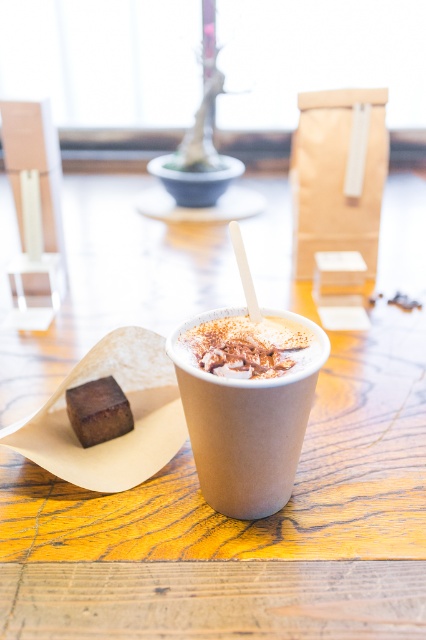
Is brown paper cup at center taller than creme matte coffee cup at center?

Yes, brown paper cup at center is taller than creme matte coffee cup at center.

Which is more to the left, brown paper cup at center or creme matte coffee cup at center?

Positioned to the left is brown paper cup at center.

Is point (180, 388) closer to camera compared to point (219, 326)?

Yes.

Locate an element on the screen. The height and width of the screenshot is (640, 426). brown paper cup at center is located at coordinates (247, 422).

Who is more forward, (239,504) or (86,424)?

Positioned in front is point (239,504).

Between point (261, 472) and point (106, 419), which one is positioned behind?

The point (106, 419) is more distant.

Locate an element on the screen. brown paper cup at center is located at coordinates (247, 422).

Does wooden table at center have a greater height compared to creme matte coffee cup at center?

Yes.

Based on the photo, is wooden table at center positioned behind creme matte coffee cup at center?

No, it is in front of creme matte coffee cup at center.

Locate an element on the screen. The width and height of the screenshot is (426, 640). wooden table at center is located at coordinates (242, 525).

The image size is (426, 640). I want to click on wooden table at center, so click(x=242, y=525).